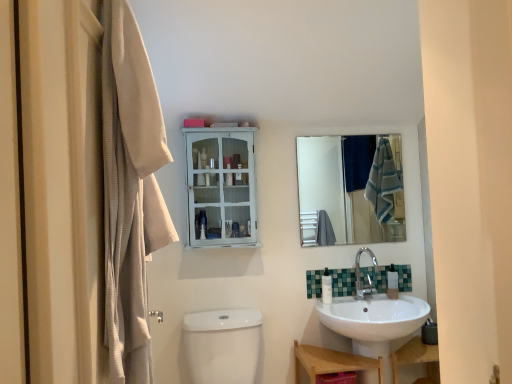
Locate an element on the screen. This screenshot has height=384, width=512. free spot to the right of white glossy soap dispenser at lower center, which is counted as the 1th toiletry, starting from the left is located at coordinates (353, 299).